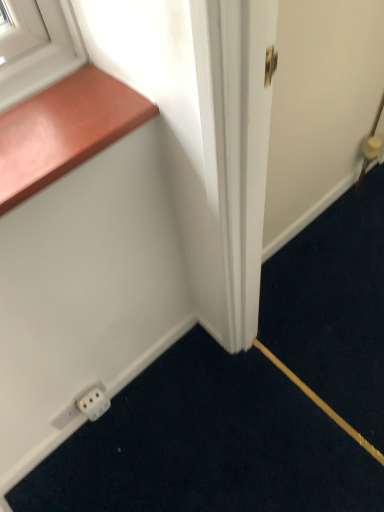
What are the coordinates of `white plastic outlet at lower left, the first electric outlet when ordered from right to left` in the screenshot? It's located at (94, 403).

How much space does white plastic outlet at lower left, the second electric outlet positioned from the left, occupy vertically?

It is 3.76 inches.

Image resolution: width=384 pixels, height=512 pixels. Find the location of `wooden at upper left`. wooden at upper left is located at coordinates (64, 130).

Which object is closer to the camera taking this photo, white plastic electric outlet at lower left, the second electric outlet when ordered from right to left, or wooden at upper left?

wooden at upper left is closer to the camera.

Between point (84, 400) and point (73, 90), which one is positioned behind?

The point (84, 400) is behind.

Is wooden at upper left inside white plastic electric outlet at lower left, acting as the first electric outlet starting from the left?

No.

In the image, is white plastic electric outlet at lower left, acting as the first electric outlet starting from the left, on the left side or the right side of white plastic outlet at lower left, the first electric outlet when ordered from right to left?

white plastic electric outlet at lower left, acting as the first electric outlet starting from the left, is to the left of white plastic outlet at lower left, the first electric outlet when ordered from right to left.

In terms of size, does white plastic electric outlet at lower left, acting as the first electric outlet starting from the left, appear bigger or smaller than white plastic outlet at lower left, the second electric outlet positioned from the left?

white plastic electric outlet at lower left, acting as the first electric outlet starting from the left, is smaller than white plastic outlet at lower left, the second electric outlet positioned from the left.

From a real-world perspective, is white plastic electric outlet at lower left, the second electric outlet when ordered from right to left, physically above white plastic outlet at lower left, the second electric outlet positioned from the left?

Incorrect, from a real-world perspective, white plastic electric outlet at lower left, the second electric outlet when ordered from right to left, is lower than white plastic outlet at lower left, the second electric outlet positioned from the left.

Is white plastic electric outlet at lower left, the second electric outlet when ordered from right to left, far away from white plastic outlet at lower left, the second electric outlet positioned from the left?

white plastic electric outlet at lower left, the second electric outlet when ordered from right to left, is actually quite close to white plastic outlet at lower left, the second electric outlet positioned from the left.

Between wooden at upper left and white plastic outlet at lower left, the first electric outlet when ordered from right to left, which one appears on the left side from the viewer's perspective?

white plastic outlet at lower left, the first electric outlet when ordered from right to left.

Is wooden at upper left not close to white plastic outlet at lower left, the second electric outlet positioned from the left?

That's not correct — wooden at upper left is a little close to white plastic outlet at lower left, the second electric outlet positioned from the left.

In terms of height, does wooden at upper left look taller or shorter compared to white plastic outlet at lower left, the second electric outlet positioned from the left?

Clearly, wooden at upper left is shorter compared to white plastic outlet at lower left, the second electric outlet positioned from the left.

Could you tell me if wooden at upper left is turned towards white plastic outlet at lower left, the first electric outlet when ordered from right to left?

No, wooden at upper left does not turn towards white plastic outlet at lower left, the first electric outlet when ordered from right to left.

From the image's perspective, does white plastic outlet at lower left, the second electric outlet positioned from the left, appear higher than wooden at upper left?

No.

Is white plastic outlet at lower left, the first electric outlet when ordered from right to left, not near wooden at upper left?

They are positioned close to each other.

Is white plastic outlet at lower left, the second electric outlet positioned from the left, wider than wooden at upper left?

Incorrect, the width of white plastic outlet at lower left, the second electric outlet positioned from the left, does not surpass that of wooden at upper left.

Who is smaller, white plastic outlet at lower left, the first electric outlet when ordered from right to left, or wooden at upper left?

white plastic outlet at lower left, the first electric outlet when ordered from right to left, is smaller.

From a real-world perspective, is white plastic outlet at lower left, the second electric outlet positioned from the left, located beneath white plastic electric outlet at lower left, acting as the first electric outlet starting from the left?

Actually, white plastic outlet at lower left, the second electric outlet positioned from the left, is physically above white plastic electric outlet at lower left, acting as the first electric outlet starting from the left, in the real world.

Considering the relative sizes of white plastic outlet at lower left, the second electric outlet positioned from the left, and white plastic electric outlet at lower left, acting as the first electric outlet starting from the left, in the image provided, is white plastic outlet at lower left, the second electric outlet positioned from the left, wider than white plastic electric outlet at lower left, acting as the first electric outlet starting from the left,?

Yes, white plastic outlet at lower left, the second electric outlet positioned from the left, is wider than white plastic electric outlet at lower left, acting as the first electric outlet starting from the left.

Would you say white plastic outlet at lower left, the first electric outlet when ordered from right to left, is outside white plastic electric outlet at lower left, acting as the first electric outlet starting from the left?

white plastic outlet at lower left, the first electric outlet when ordered from right to left, is positioned outside white plastic electric outlet at lower left, acting as the first electric outlet starting from the left.

Is white plastic outlet at lower left, the second electric outlet positioned from the left, looking in the opposite direction of white plastic electric outlet at lower left, acting as the first electric outlet starting from the left?

Correct, white plastic outlet at lower left, the second electric outlet positioned from the left, is looking away from white plastic electric outlet at lower left, acting as the first electric outlet starting from the left.

Does wooden at upper left have a smaller size compared to white plastic electric outlet at lower left, the second electric outlet when ordered from right to left?

No.

I want to click on window sill on the right of white plastic electric outlet at lower left, the second electric outlet when ordered from right to left, so click(x=64, y=130).

Considering the points (42, 157) and (102, 413), which point is behind, point (42, 157) or point (102, 413)?

Point (102, 413)

Are wooden at upper left and white plastic electric outlet at lower left, the second electric outlet when ordered from right to left, located far from each other?

wooden at upper left is near white plastic electric outlet at lower left, the second electric outlet when ordered from right to left, not far away.

Locate an element on the screen. This screenshot has width=384, height=512. window sill lying on the right of white plastic electric outlet at lower left, the second electric outlet when ordered from right to left is located at coordinates (64, 130).

There is a white plastic electric outlet at lower left, the second electric outlet when ordered from right to left. Identify the location of electric outlet above it (from a real-world perspective). (94, 403).

In the scene shown: Estimate the real-world distances between objects in this image. Which object is closer to white plastic outlet at lower left, the second electric outlet positioned from the left, white plastic electric outlet at lower left, acting as the first electric outlet starting from the left, or wooden at upper left?

white plastic electric outlet at lower left, acting as the first electric outlet starting from the left, is positioned closer to the anchor white plastic outlet at lower left, the second electric outlet positioned from the left.

Estimate the real-world distances between objects in this image. Which object is further from white plastic electric outlet at lower left, the second electric outlet when ordered from right to left, white plastic outlet at lower left, the first electric outlet when ordered from right to left, or wooden at upper left?

wooden at upper left is positioned further to the anchor white plastic electric outlet at lower left, the second electric outlet when ordered from right to left.

When comparing their distances from wooden at upper left, does white plastic electric outlet at lower left, acting as the first electric outlet starting from the left, or white plastic outlet at lower left, the second electric outlet positioned from the left, seem further?

white plastic outlet at lower left, the second electric outlet positioned from the left, is positioned further to the anchor wooden at upper left.

Looking at the image, which one is located closer to wooden at upper left, white plastic outlet at lower left, the first electric outlet when ordered from right to left, or white plastic electric outlet at lower left, the second electric outlet when ordered from right to left?

Among the two, white plastic electric outlet at lower left, the second electric outlet when ordered from right to left, is located nearer to wooden at upper left.

Looking at the image, which one is located closer to white plastic outlet at lower left, the first electric outlet when ordered from right to left, wooden at upper left or white plastic electric outlet at lower left, the second electric outlet when ordered from right to left?

white plastic electric outlet at lower left, the second electric outlet when ordered from right to left, is closer to white plastic outlet at lower left, the first electric outlet when ordered from right to left.

Considering their positions, is wooden at upper left positioned closer to white plastic electric outlet at lower left, the second electric outlet when ordered from right to left, than white plastic outlet at lower left, the first electric outlet when ordered from right to left?

Based on the image, white plastic outlet at lower left, the first electric outlet when ordered from right to left, appears to be nearer to white plastic electric outlet at lower left, the second electric outlet when ordered from right to left.

The image size is (384, 512). In order to click on electric outlet between wooden at upper left and white plastic electric outlet at lower left, acting as the first electric outlet starting from the left, in the vertical direction in this screenshot , I will do `click(94, 403)`.